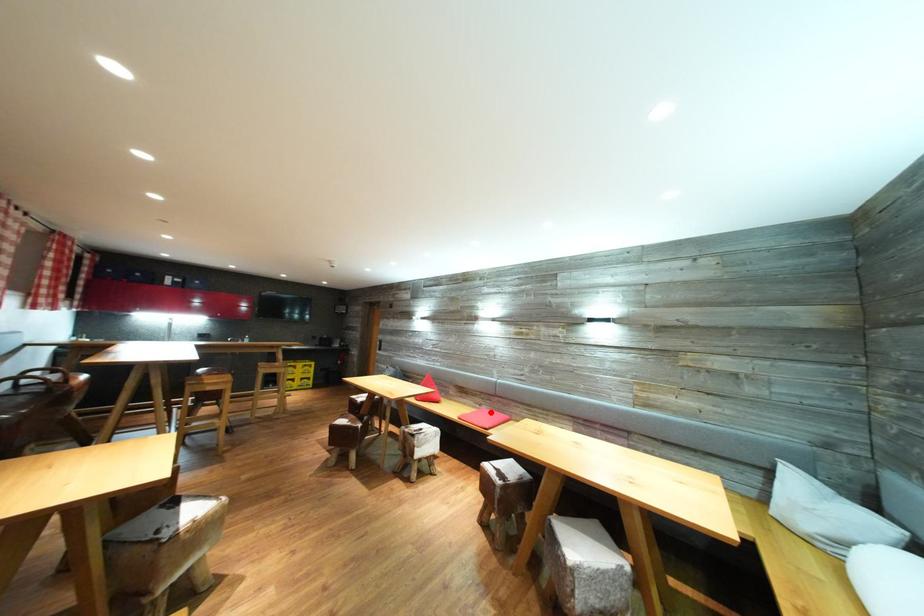
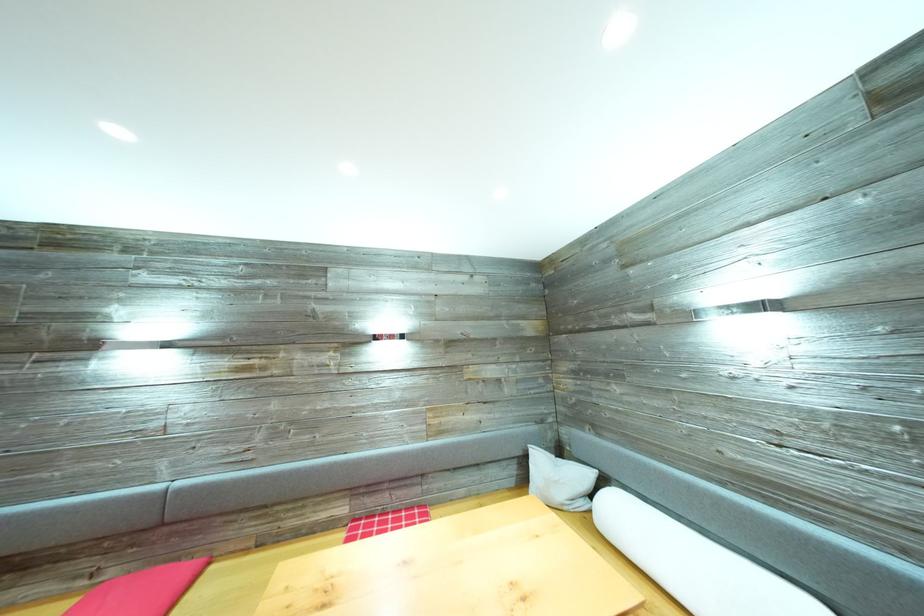
Question: I am providing you with two images of the same scene from different viewpoints. Image1 has a red point marked. In image2, the corresponding 3D location appears at what relative position? Reply with the corresponding letter.

Choices:
 (A) Closer
 (B) Farther

Answer: (A)